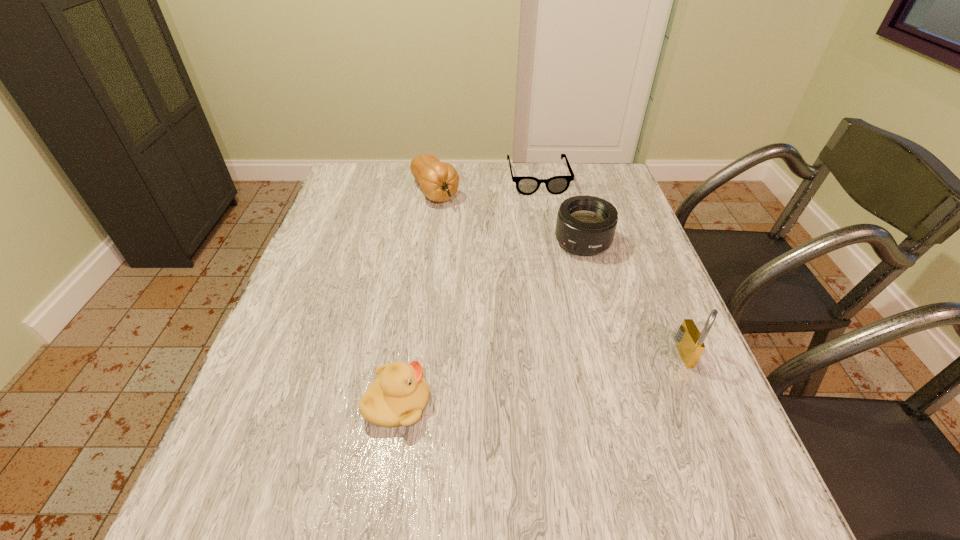
You are a GUI agent. You are given a task and a screenshot of the screen. Output one action in this format:
    pyautogui.click(x=<x>, y=<y>)
    Task: Click on the duckling
    Image resolution: width=960 pixels, height=540 pixels.
    Given the screenshot: What is the action you would take?
    pyautogui.click(x=398, y=396)

You are a GUI agent. You are given a task and a screenshot of the screen. Output one action in this format:
    pyautogui.click(x=<x>, y=<y>)
    Task: Click on the rightmost object
    Image resolution: width=960 pixels, height=540 pixels.
    Given the screenshot: What is the action you would take?
    pyautogui.click(x=690, y=342)

The width and height of the screenshot is (960, 540). Find the location of `padlock`. padlock is located at coordinates (690, 342).

This screenshot has height=540, width=960. I want to click on gourd, so click(439, 181).

Locate an element on the screen. The width and height of the screenshot is (960, 540). telephoto lens is located at coordinates (586, 225).

You are a GUI agent. You are given a task and a screenshot of the screen. Output one action in this format:
    pyautogui.click(x=<x>, y=<y>)
    Task: Click on the spectacles
    
    Given the screenshot: What is the action you would take?
    pyautogui.click(x=526, y=185)

Image resolution: width=960 pixels, height=540 pixels. I want to click on free space located 0.110m on the front-facing side of the nearest object, so click(488, 403).

The width and height of the screenshot is (960, 540). I want to click on vacant space located 0.260m on the stem side of the gourd, so click(486, 260).

Where is `vacant area situated 0.370m on the stem side of the gourd`? The image size is (960, 540). vacant area situated 0.370m on the stem side of the gourd is located at coordinates (507, 286).

Find the location of a particular element. Image resolution: width=960 pixels, height=540 pixels. vacant space situated on the stem side of the gourd is located at coordinates (509, 289).